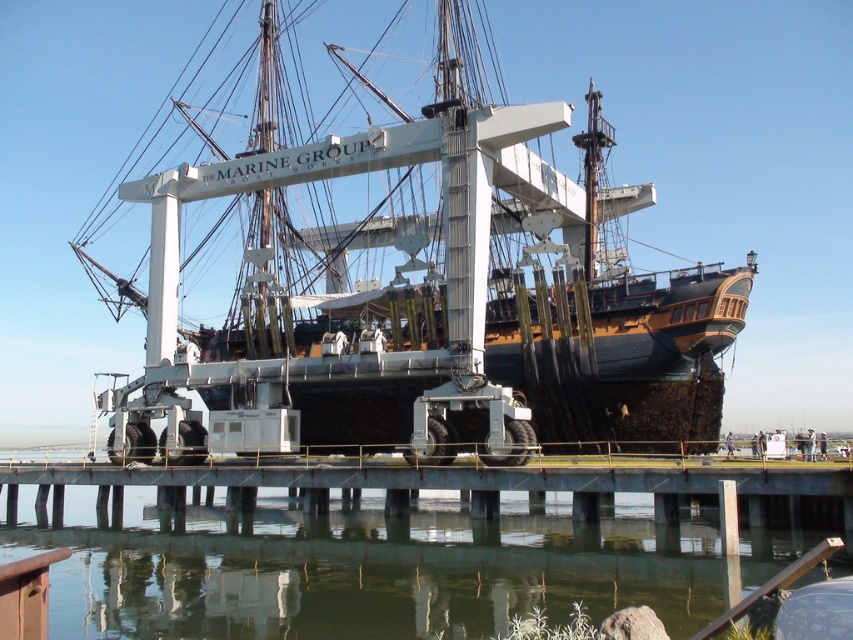
Does wooden pirate ship at center lie in front of greenish water at lower center?

Answer: No, wooden pirate ship at center is behind greenish water at lower center.

Does wooden pirate ship at center appear on the left side of greenish water at lower center?

Incorrect, wooden pirate ship at center is not on the left side of greenish water at lower center.

Describe the element at coordinates (425, 296) in the screenshot. I see `wooden pirate ship at center` at that location.

Identify the location of wooden pirate ship at center. This screenshot has width=853, height=640. (425, 296).